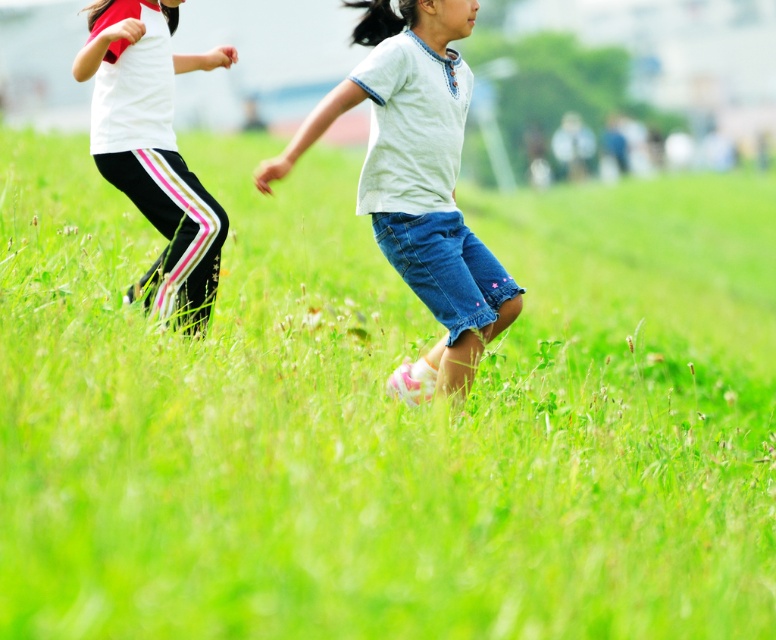
What are the coordinates of `white cotton shirt at center` in the screenshot? It's located at [x=418, y=180].

Does white cotton shirt at center have a larger size compared to white matte pants at left?

No.

Between point (424, 388) and point (130, 68), which one is positioned in front?

Point (424, 388) is in front.

The image size is (776, 640). I want to click on white cotton shirt at center, so click(418, 180).